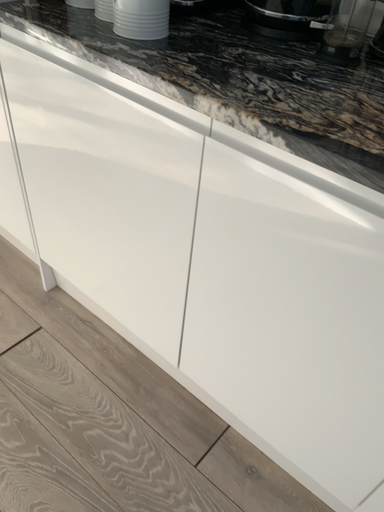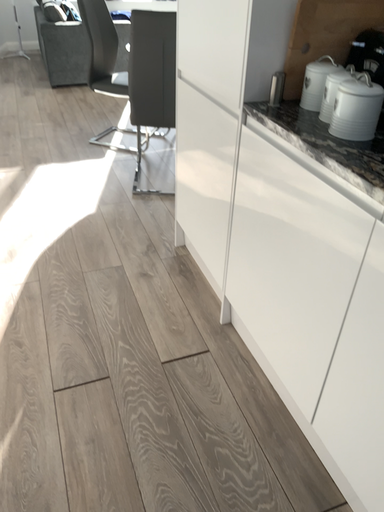
Question: How did the camera likely rotate when shooting the video?

Choices:
 (A) rotated left
 (B) rotated right

Answer: (A)